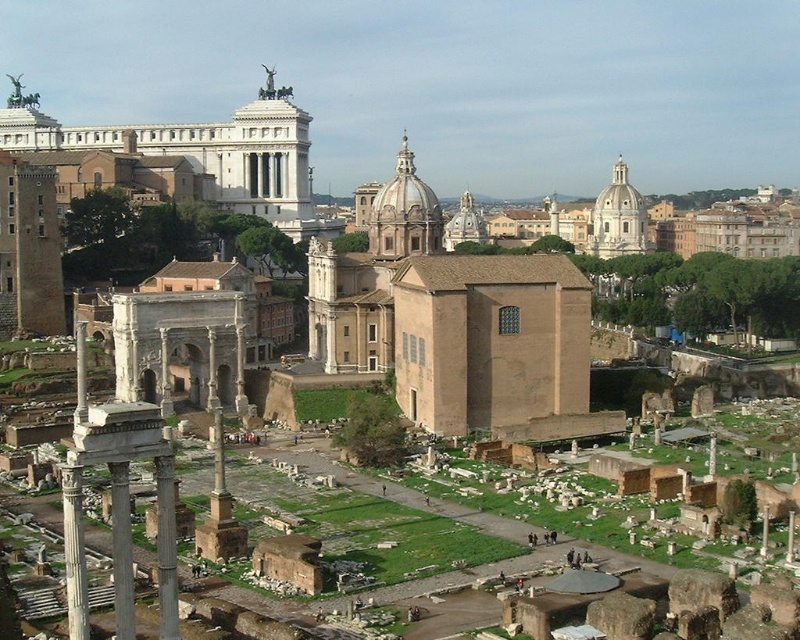
Question: Which point is farther to the camera?

Choices:
 (A) (x=790, y=529)
 (B) (x=66, y=506)
 (C) (x=74, y=417)

Answer: (C)

Question: Is white marble pillar at center closer to camera compared to smooth stone column at center?

Choices:
 (A) no
 (B) yes

Answer: (B)

Question: Does gray stone column at center have a larger size compared to white marble pillar at lower left?

Choices:
 (A) no
 (B) yes

Answer: (A)

Question: Does white marble column at lower left lie behind smooth stone column at left?

Choices:
 (A) yes
 (B) no

Answer: (B)

Question: Among these points, which one is nearest to the camera?

Choices:
 (A) (794, 515)
 (B) (768, 531)
 (C) (168, 496)
 (D) (124, 589)

Answer: (D)

Question: Among these points, which one is farthest from the camera?

Choices:
 (A) (72, 493)
 (B) (166, 580)
 (C) (766, 518)

Answer: (C)